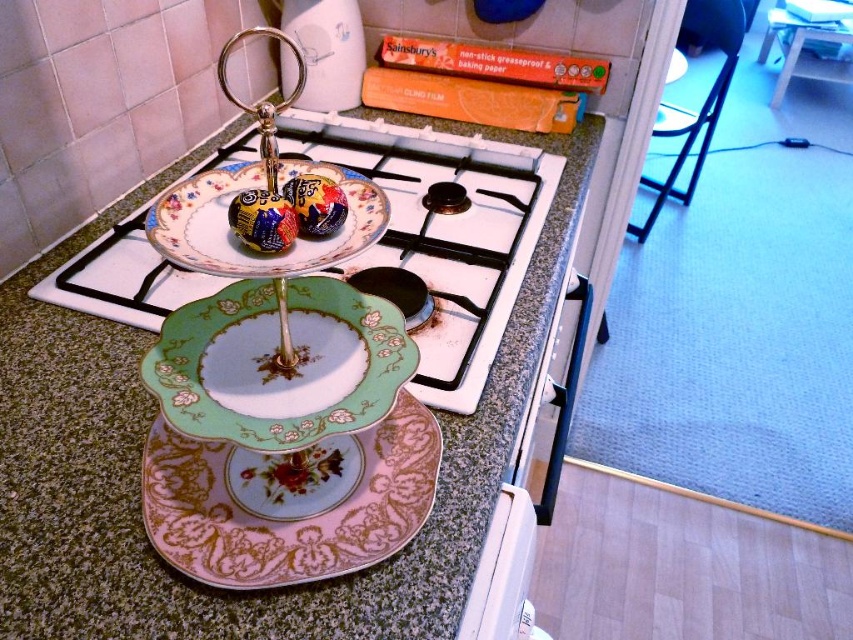
Question: Is pink porcelain platter at center above matte ceramic chocolate at center?

Choices:
 (A) no
 (B) yes

Answer: (A)

Question: Among these points, which one is nearest to the camera?

Choices:
 (A) (91, 346)
 (B) (171, 337)
 (C) (292, 212)
 (D) (575, 291)

Answer: (C)

Question: Observing the image, what is the correct spatial positioning of green porcelain plate at center in reference to matte ceramic chocolate at center?

Choices:
 (A) above
 (B) below

Answer: (B)

Question: Which point appears farthest from the camera in this image?

Choices:
 (A) (577, 330)
 (B) (285, 272)
 (C) (285, 186)

Answer: (A)

Question: Can you confirm if white glossy oven at lower right is positioned above matte ceramic chocolate at center?

Choices:
 (A) yes
 (B) no

Answer: (B)

Question: Which object is the closest to the pink porcelain platter at center?

Choices:
 (A) matte ceramic chocolate at center
 (B) porcelain floral plate at center
 (C) shiny metallic chocolate bar at center
 (D) green porcelain plate at center

Answer: (D)